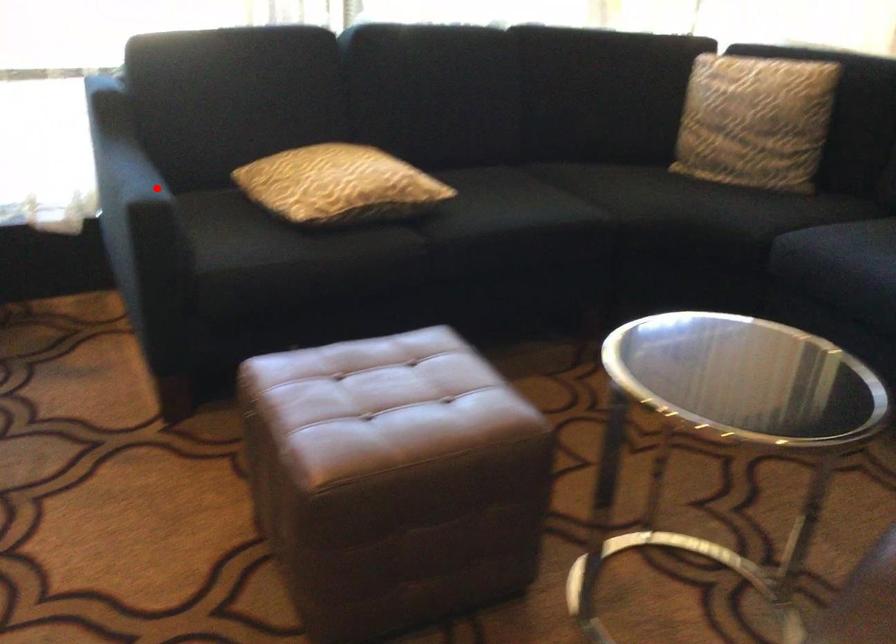
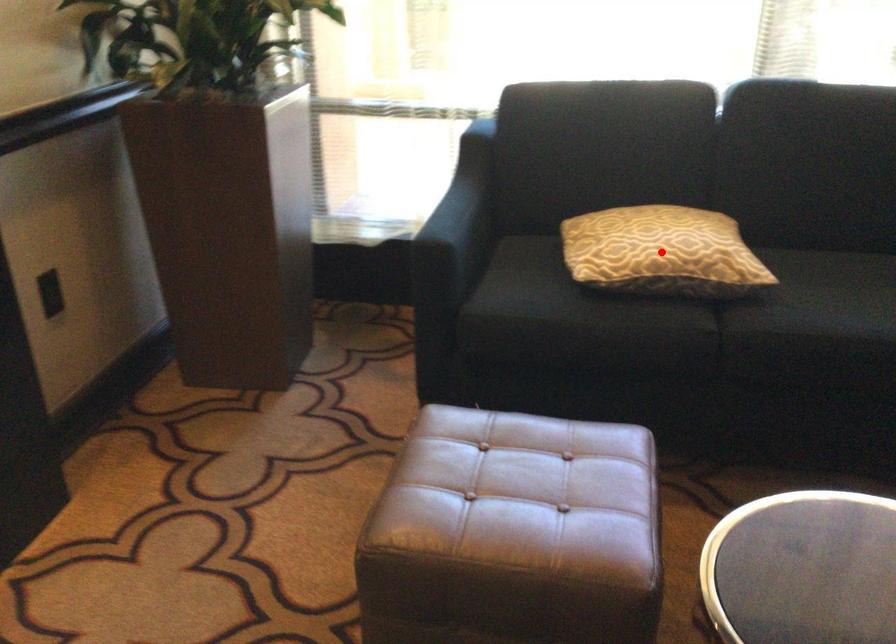
I am providing you with two images of the same scene from different viewpoints. A red point is marked on the first image and another point is marked on the second image. Are the points marked in image1 and image2 representing the same 3D position?

No